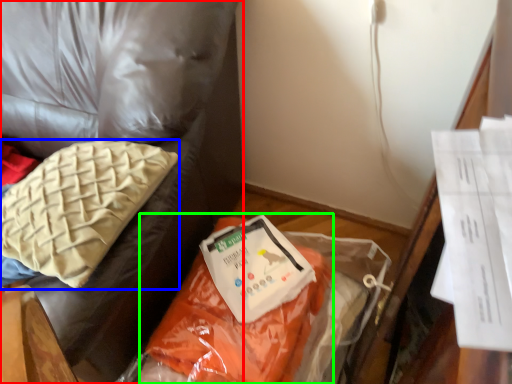
Question: Considering the real-world distances, which object is closest to furniture (highlighted by a red box)? pillow (highlighted by a blue box) or stuff (highlighted by a green box).

Choices:
 (A) pillow
 (B) stuff

Answer: (A)